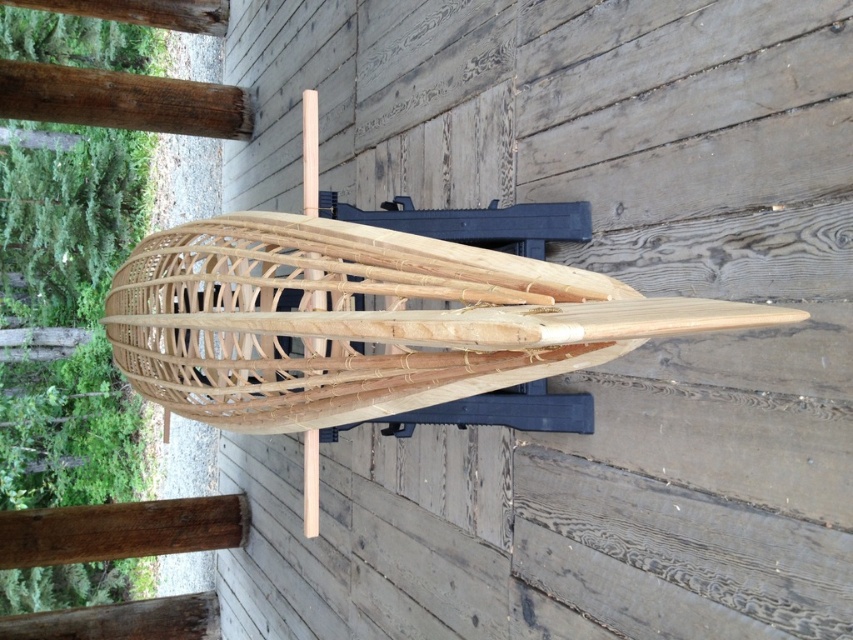
Is natural wood boat at center below brown wood beam at upper left?

Indeed, natural wood boat at center is positioned under brown wood beam at upper left.

Does point (641, 305) lie in front of point (105, 108)?

Yes.

Where is `natural wood boat at center`? This screenshot has width=853, height=640. natural wood boat at center is located at coordinates (363, 321).